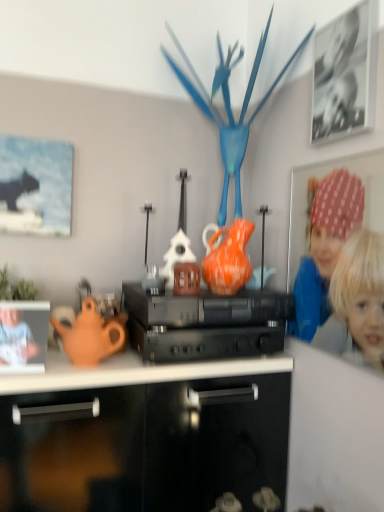
Question: Should I look upward or downward to see orange glazed earthenware teapot at center?

Choices:
 (A) up
 (B) down

Answer: (B)

Question: Is matte black cat at upper left, which is counted as the 2th picture frame, starting from the front, beside matte orange teapot at left?

Choices:
 (A) no
 (B) yes

Answer: (A)

Question: Can we say matte black cat at upper left, the 2th picture frame from the top, lies outside matte orange teapot at left?

Choices:
 (A) no
 (B) yes

Answer: (B)

Question: From the image's perspective, does matte black cat at upper left, which is counted as the 2th picture frame, starting from the right, appear lower than matte orange teapot at left?

Choices:
 (A) no
 (B) yes

Answer: (A)

Question: Is matte black cat at upper left, which ranks as the 1th picture frame in bottom-to-top order, smaller than matte orange teapot at left?

Choices:
 (A) yes
 (B) no

Answer: (B)

Question: Is matte black cat at upper left, the 2th picture frame from the top, oriented away from matte orange teapot at left?

Choices:
 (A) yes
 (B) no

Answer: (B)

Question: From a real-world perspective, is matte black cat at upper left, which is counted as the 2th picture frame, starting from the front, physically below matte orange teapot at left?

Choices:
 (A) yes
 (B) no

Answer: (B)

Question: Is polka dot fabric at upper right, arranged as the first person when viewed from the right, at the right side of orange glazed earthenware teapot at center?

Choices:
 (A) no
 (B) yes

Answer: (B)

Question: Does polka dot fabric at upper right, acting as the second person starting from the left, have a lesser width compared to orange glazed earthenware teapot at center?

Choices:
 (A) no
 (B) yes

Answer: (B)

Question: From the image's perspective, is polka dot fabric at upper right, acting as the second person starting from the left, beneath orange glazed earthenware teapot at center?

Choices:
 (A) no
 (B) yes

Answer: (B)

Question: Is polka dot fabric at upper right, acting as the second person starting from the left, next to orange glazed earthenware teapot at center?

Choices:
 (A) yes
 (B) no

Answer: (B)

Question: Is polka dot fabric at upper right, acting as the second person starting from the left, smaller than orange glazed earthenware teapot at center?

Choices:
 (A) no
 (B) yes

Answer: (B)

Question: Is polka dot fabric at upper right, arranged as the first person when viewed from the right, wider than orange glazed earthenware teapot at center?

Choices:
 (A) no
 (B) yes

Answer: (A)

Question: Is the position of black plastic stereo at center less distant than that of black matte picture frame at upper right, which is the 2th picture frame from left to right?

Choices:
 (A) no
 (B) yes

Answer: (A)